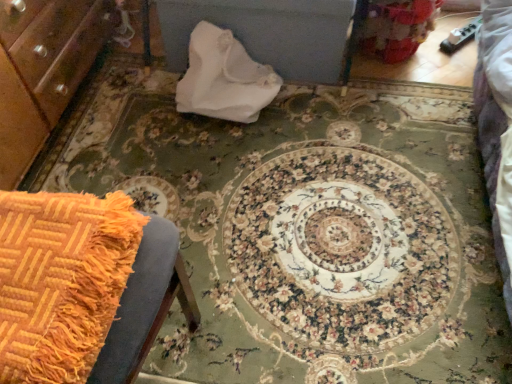
Question: Does orange woven blanket at lower left have a greater height compared to white paper bag at center?

Choices:
 (A) yes
 (B) no

Answer: (B)

Question: From the image's perspective, is orange woven blanket at lower left over white paper bag at center?

Choices:
 (A) yes
 (B) no

Answer: (B)

Question: Can you confirm if orange woven blanket at lower left is thinner than white paper bag at center?

Choices:
 (A) yes
 (B) no

Answer: (B)

Question: Can you confirm if orange woven blanket at lower left is bigger than white paper bag at center?

Choices:
 (A) yes
 (B) no

Answer: (B)

Question: Is orange woven blanket at lower left facing towards white paper bag at center?

Choices:
 (A) no
 (B) yes

Answer: (A)

Question: From the image's perspective, would you say orange woven blanket at lower left is shown under white paper bag at center?

Choices:
 (A) yes
 (B) no

Answer: (A)

Question: Is the depth of white paper bag at center greater than that of orange woven blanket at lower left?

Choices:
 (A) no
 (B) yes

Answer: (B)

Question: From the image's perspective, is white paper bag at center on orange woven blanket at lower left?

Choices:
 (A) yes
 (B) no

Answer: (A)

Question: Is white paper bag at center oriented away from orange woven blanket at lower left?

Choices:
 (A) yes
 (B) no

Answer: (B)

Question: Are white paper bag at center and orange woven blanket at lower left beside each other?

Choices:
 (A) yes
 (B) no

Answer: (B)

Question: Is white paper bag at center wider than orange woven blanket at lower left?

Choices:
 (A) yes
 (B) no

Answer: (B)

Question: Is white paper bag at center positioned in front of orange woven blanket at lower left?

Choices:
 (A) no
 (B) yes

Answer: (A)

Question: Considering the positions of orange woven blanket at lower left and white paper bag at center in the image, is orange woven blanket at lower left wider or thinner than white paper bag at center?

Choices:
 (A) thin
 (B) wide

Answer: (B)